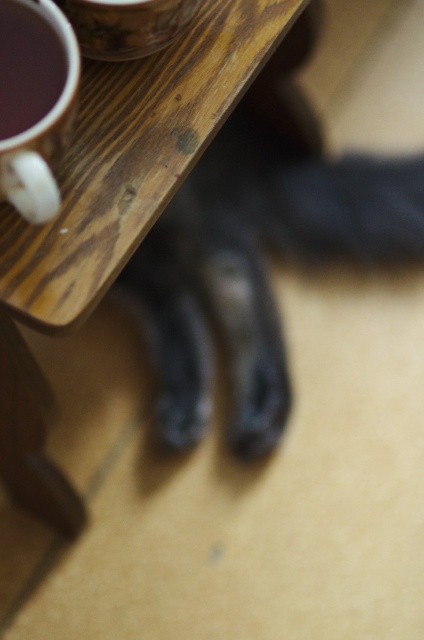
Is the position of wooden table at upper center less distant than that of matte ceramic cup at upper left?

No, it is behind matte ceramic cup at upper left.

Can you confirm if wooden table at upper center is taller than matte ceramic cup at upper left?

Indeed, wooden table at upper center has a greater height compared to matte ceramic cup at upper left.

Between point (203, 64) and point (47, 54), which one is positioned behind?

The point (203, 64) is more distant.

Locate an element on the screen. wooden table at upper center is located at coordinates (113, 211).